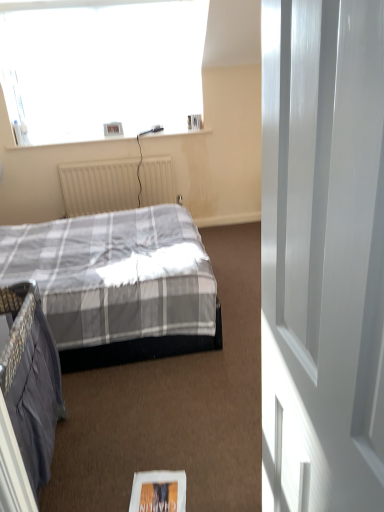
Question: Is white glossy door at right oriented away from beige textured radiator at center?

Choices:
 (A) no
 (B) yes

Answer: (A)

Question: Considering the relative positions of white glossy door at right and beige textured radiator at center in the image provided, is white glossy door at right to the right of beige textured radiator at center from the viewer's perspective?

Choices:
 (A) no
 (B) yes

Answer: (B)

Question: From the image's perspective, does white glossy door at right appear lower than beige textured radiator at center?

Choices:
 (A) yes
 (B) no

Answer: (A)

Question: Would you say white glossy door at right is outside beige textured radiator at center?

Choices:
 (A) yes
 (B) no

Answer: (A)

Question: Is white glossy door at right aimed at beige textured radiator at center?

Choices:
 (A) yes
 (B) no

Answer: (B)

Question: Does white glossy door at right have a larger size compared to beige textured radiator at center?

Choices:
 (A) no
 (B) yes

Answer: (A)

Question: Are beige textured radiator at center and white paper magazine at lower center far apart?

Choices:
 (A) yes
 (B) no

Answer: (A)

Question: Does beige textured radiator at center have a lesser width compared to white paper magazine at lower center?

Choices:
 (A) no
 (B) yes

Answer: (B)

Question: From a real-world perspective, is beige textured radiator at center located higher than white paper magazine at lower center?

Choices:
 (A) no
 (B) yes

Answer: (B)

Question: Considering the relative sizes of beige textured radiator at center and white paper magazine at lower center in the image provided, is beige textured radiator at center shorter than white paper magazine at lower center?

Choices:
 (A) no
 (B) yes

Answer: (A)

Question: Is beige textured radiator at center to the left of white paper magazine at lower center from the viewer's perspective?

Choices:
 (A) no
 (B) yes

Answer: (B)

Question: Is white paper magazine at lower center surrounded by beige textured radiator at center?

Choices:
 (A) no
 (B) yes

Answer: (A)

Question: Could you tell me if beige textured radiator at center is facing white glossy door at right?

Choices:
 (A) no
 (B) yes

Answer: (B)